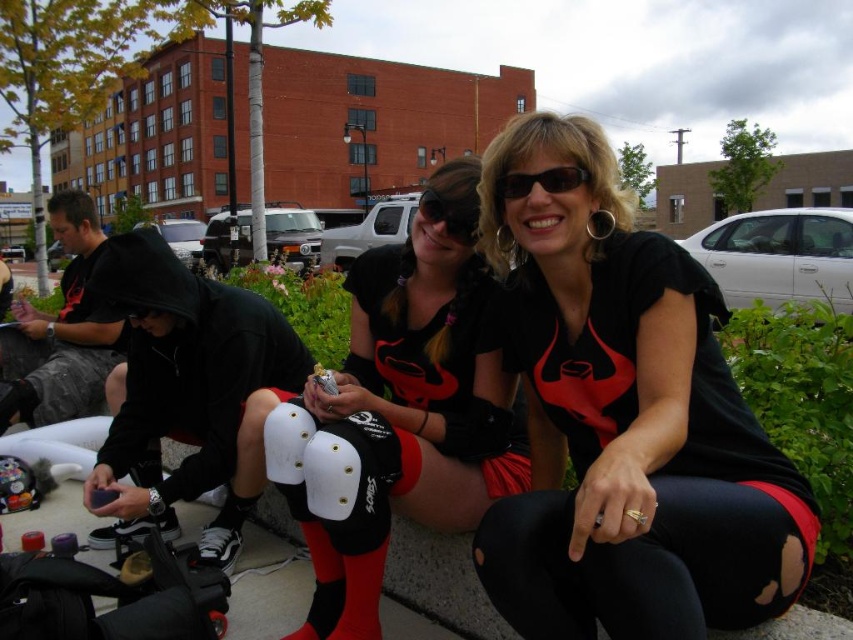
You are standing in the public space near the brick building and want to walk from point A to point B. Point A is at coordinates point (448, 387) and point B is at point (506, 193). Which point should you start from to reach the other without walking away from the brick building?

You should start from point A at coordinates point (448, 387) because it is closer to the brick building than point B at point (506, 193), so moving from A to B keeps you heading towards the building.